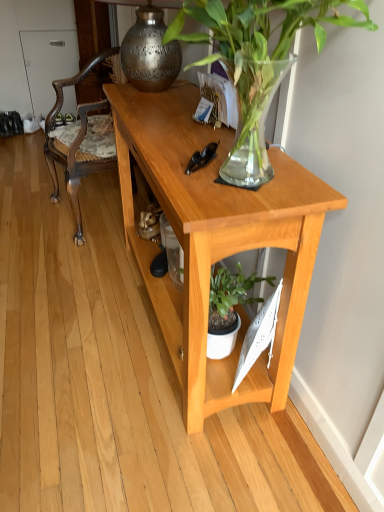
Identify the location of vacant space that's between polished brass lamp at upper center and black plastic sunglasses at center. This screenshot has height=512, width=384. (164, 123).